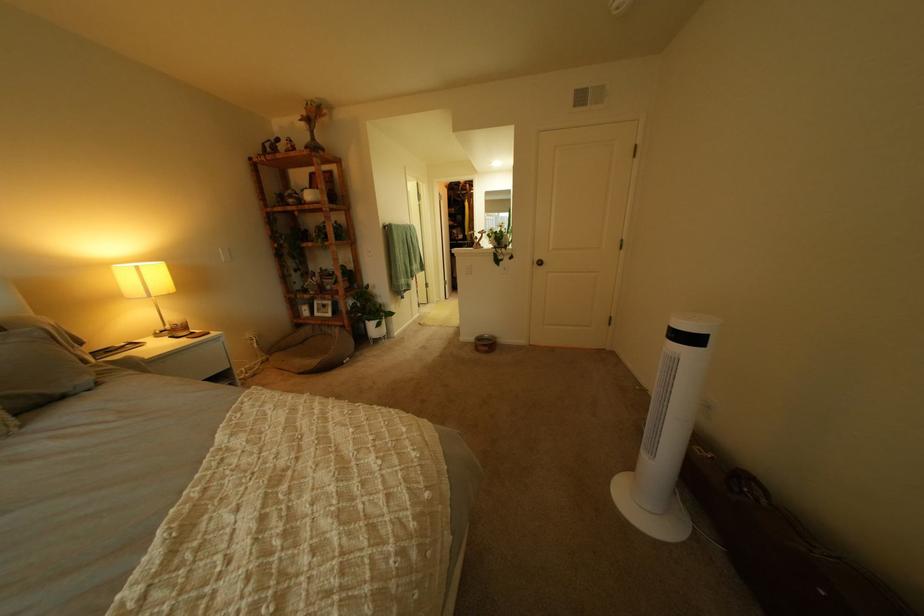
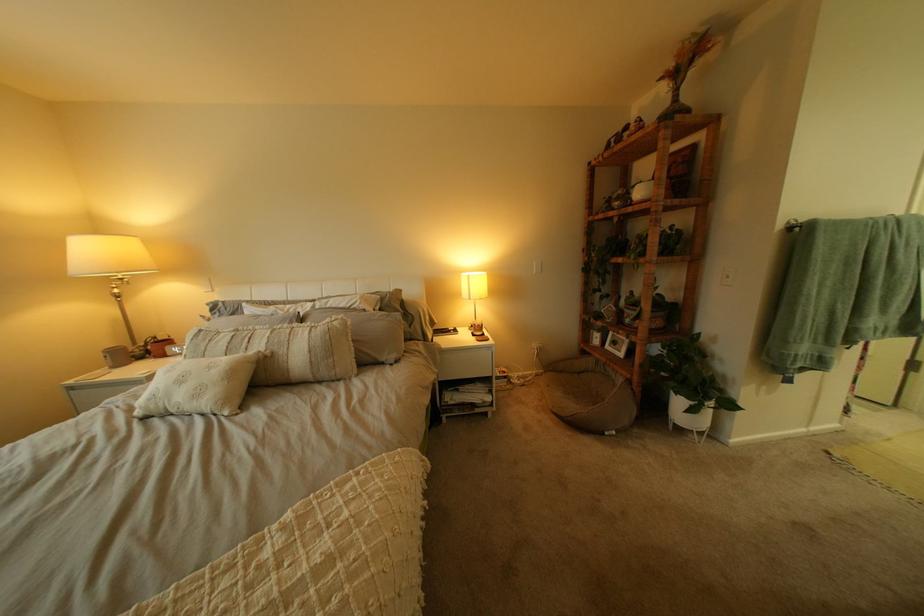
In the second image, find the point that corresponds to (x=315, y=121) in the first image.

(675, 81)